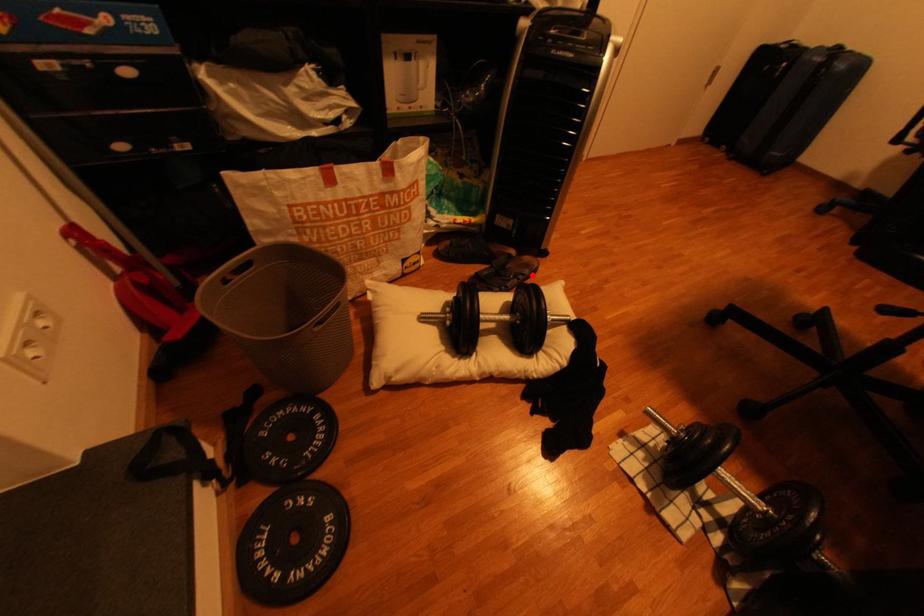
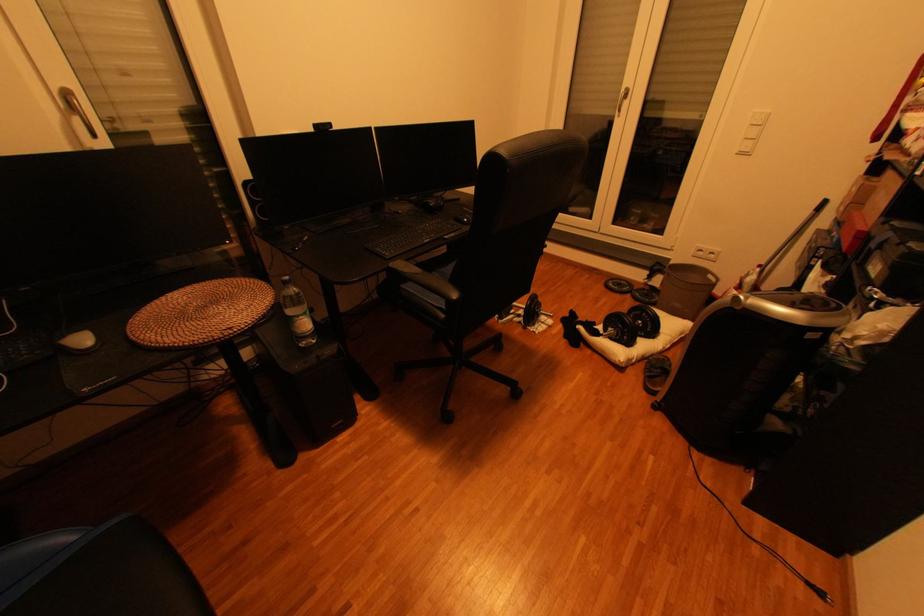
Find the pixel in the second image that matches the highlighted location in the first image.

(658, 373)